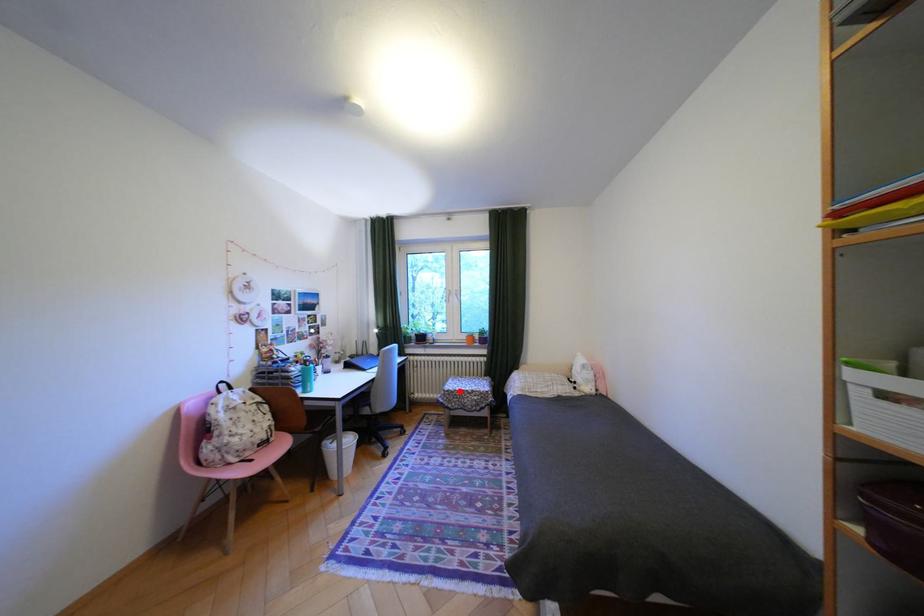
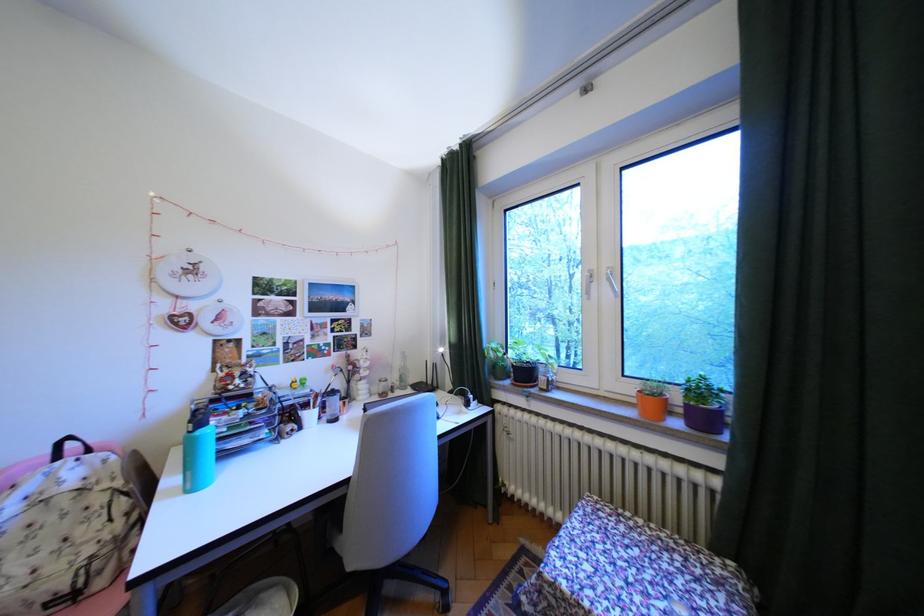
Question: I am providing you with two images of the same scene from different viewpoints. A red point is shown in image1. For the corresponding object point in image2, is it positioned nearer or farther from the camera?

Choices:
 (A) Nearer
 (B) Farther

Answer: (A)